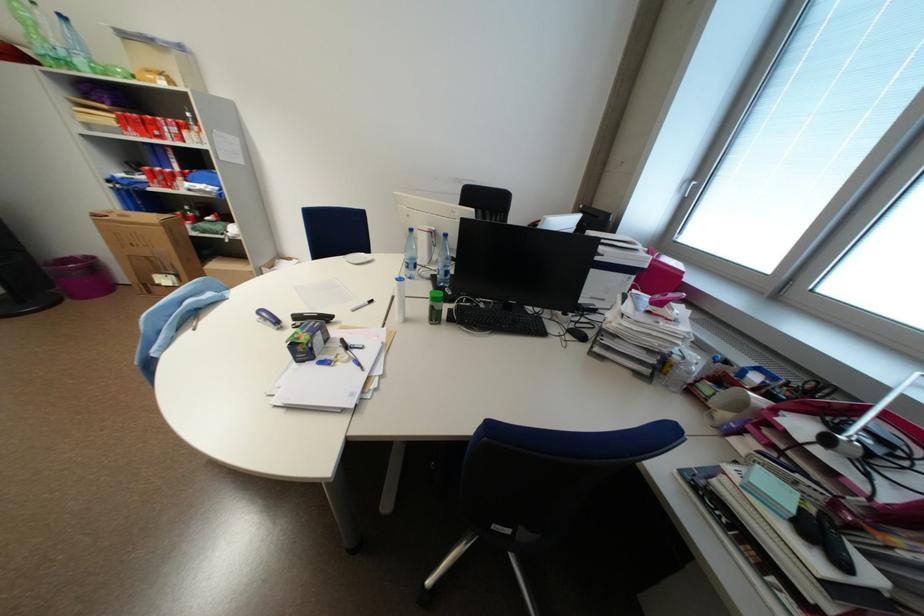
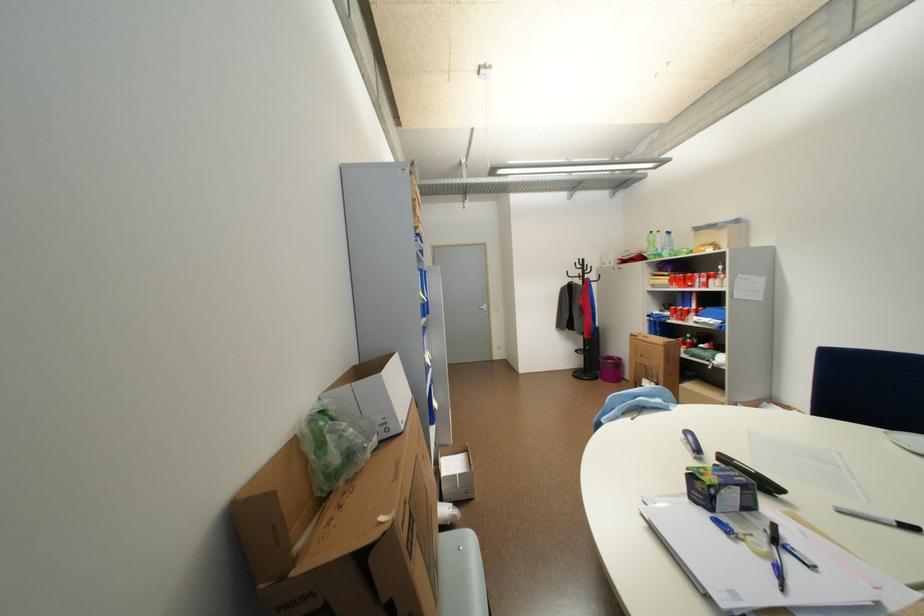
Question: The first image is from the beginning of the video and the second image is from the end. How did the camera likely rotate when shooting the video?

Choices:
 (A) Left
 (B) Right
 (C) Up
 (D) Down

Answer: (A)